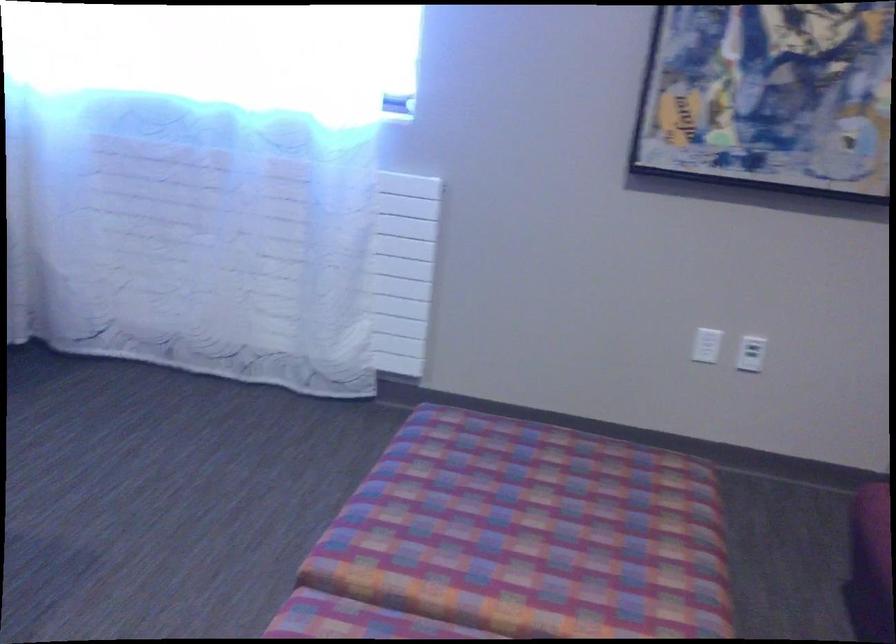
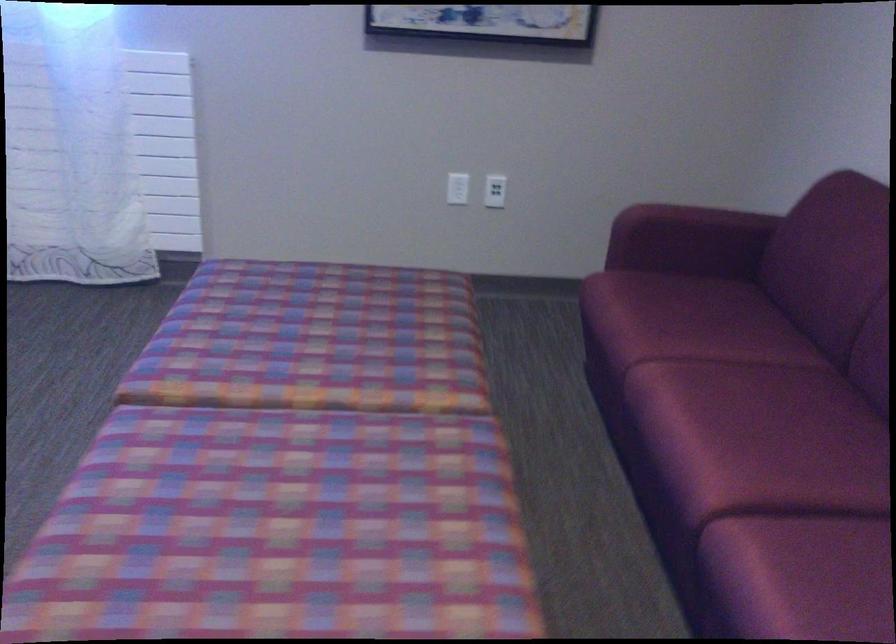
Question: The first image is from the beginning of the video and the second image is from the end. How did the camera likely rotate when shooting the video?

Choices:
 (A) Left
 (B) Right
 (C) Up
 (D) Down

Answer: (B)